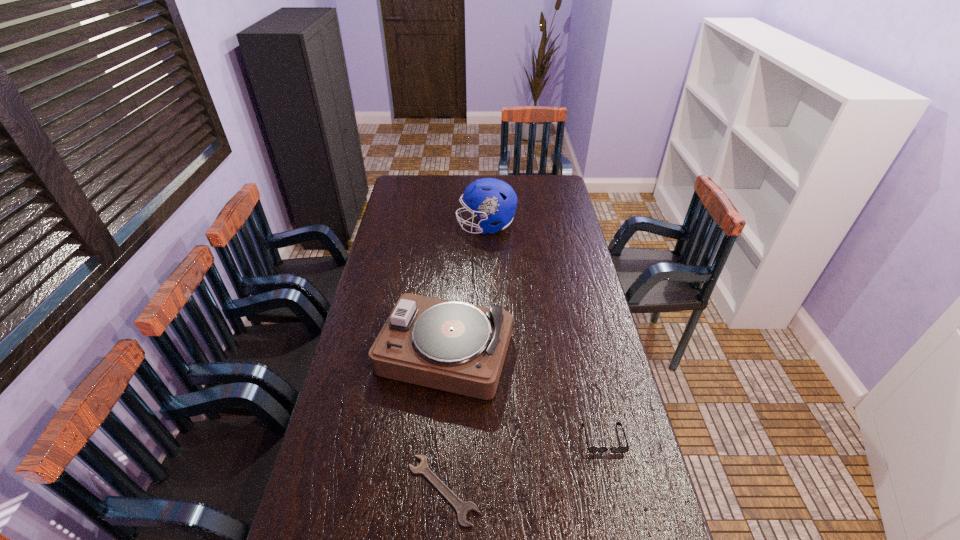
You are a GUI agent. You are given a task and a screenshot of the screen. Output one action in this format:
    pyautogui.click(x=<x>, y=<y>)
    Task: Click on the second closest object to the wrench
    This screenshot has height=540, width=960.
    Given the screenshot: What is the action you would take?
    pyautogui.click(x=591, y=449)